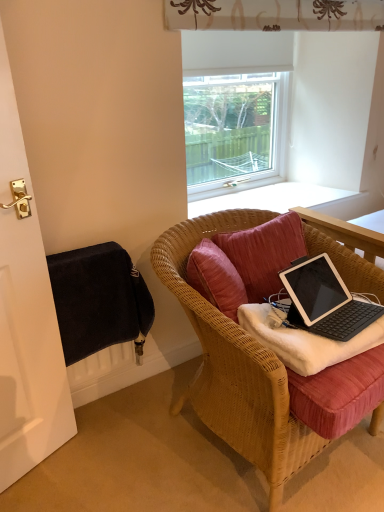
Question: Considering the relative sizes of woven wood chair at center and black fabric at left in the image provided, is woven wood chair at center shorter than black fabric at left?

Choices:
 (A) yes
 (B) no

Answer: (A)

Question: Can you confirm if woven wood chair at center is smaller than black fabric at left?

Choices:
 (A) yes
 (B) no

Answer: (B)

Question: Is woven wood chair at center located outside black fabric at left?

Choices:
 (A) no
 (B) yes

Answer: (B)

Question: Can you confirm if woven wood chair at center is taller than black fabric at left?

Choices:
 (A) no
 (B) yes

Answer: (A)

Question: Are woven wood chair at center and black fabric at left beside each other?

Choices:
 (A) yes
 (B) no

Answer: (B)

Question: From a real-world perspective, is woven wood chair at center physically above black fabric at left?

Choices:
 (A) no
 (B) yes

Answer: (A)

Question: Would you say black fabric at left is a long distance from black matte laptop at center?

Choices:
 (A) yes
 (B) no

Answer: (B)

Question: Is black fabric at left further to camera compared to black matte laptop at center?

Choices:
 (A) no
 (B) yes

Answer: (A)

Question: Is black fabric at left smaller than black matte laptop at center?

Choices:
 (A) no
 (B) yes

Answer: (A)

Question: Is black fabric at left closer to camera compared to black matte laptop at center?

Choices:
 (A) no
 (B) yes

Answer: (B)

Question: Does black fabric at left have a greater height compared to black matte laptop at center?

Choices:
 (A) no
 (B) yes

Answer: (B)

Question: From the image's perspective, does black fabric at left appear lower than black matte laptop at center?

Choices:
 (A) yes
 (B) no

Answer: (B)

Question: From a real-world perspective, is transparent glass window at upper center below black fabric radiator at lower left?

Choices:
 (A) yes
 (B) no

Answer: (B)